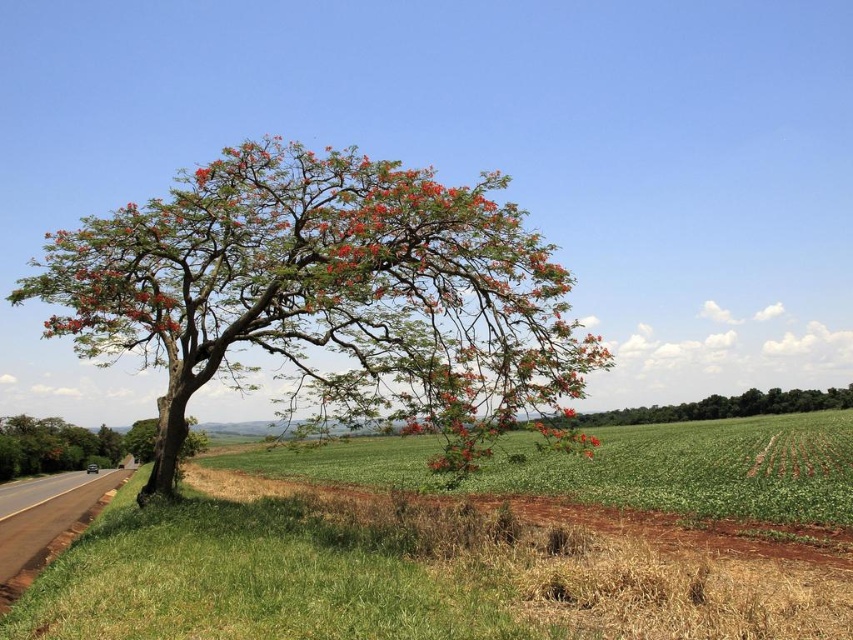
You are standing at the edge of the green grassy field at lower center and want to walk to the green leafy tree at left. Which direction should you head towards?

The green grassy field at lower center is wider than the green leafy tree at left, so you should head towards the left direction to reach the green leafy tree at left.

You are standing at the base of the large tree and want to walk to the asphalt road at lower left. Which direction should you walk to avoid the green grassy field at lower center?

You should walk to the left side of the green grassy field at lower center to reach the asphalt road at lower left without going through the field, as the road is positioned to the left of the field.

You are standing at the edge of the green grassy field at lower center and want to walk towards the green leafy tree at left. Which direction should you head?

You should head to the left because the green grassy field at lower center is to the right of the green leafy tree at left, meaning the tree is located to your left side.